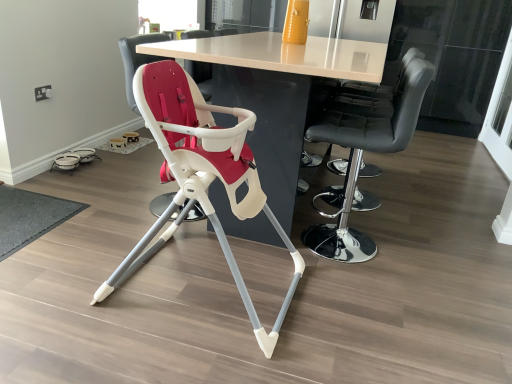
The height and width of the screenshot is (384, 512). Find the location of `unoccupied space behind black leather bar stool at right, marked as the third chair in a left-to-right arrangement`. unoccupied space behind black leather bar stool at right, marked as the third chair in a left-to-right arrangement is located at coordinates (350, 210).